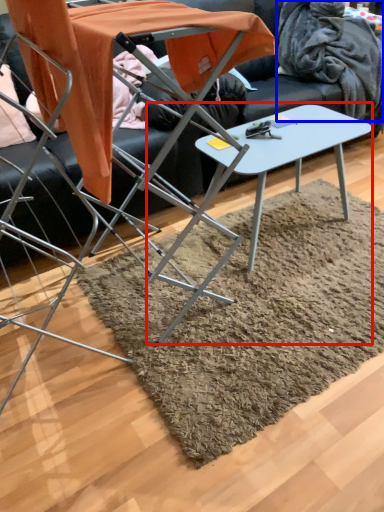
Question: Which object is further to the camera taking this photo, table (highlighted by a red box) or blanket (highlighted by a blue box)?

Choices:
 (A) table
 (B) blanket

Answer: (B)